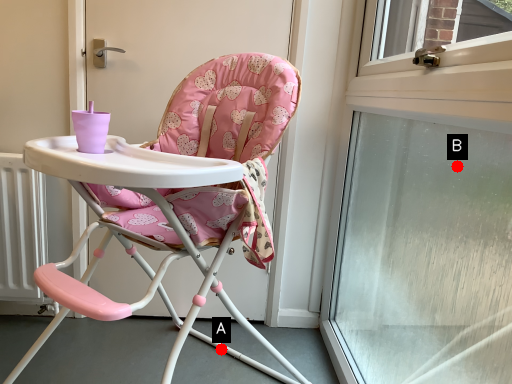
Question: Two points are circled on the image, labeled by A and B beside each circle. Which of the following is the farthest from the observer?

Choices:
 (A) A is further
 (B) B is further

Answer: (B)